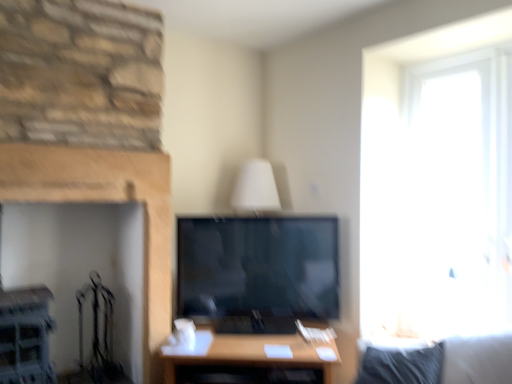
This screenshot has width=512, height=384. I want to click on empty space that is ontop of wooden table at center (from a real-world perspective), so click(258, 341).